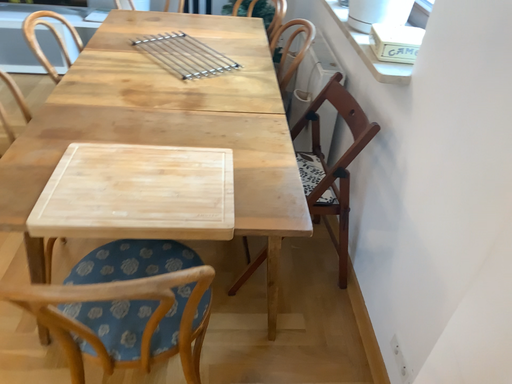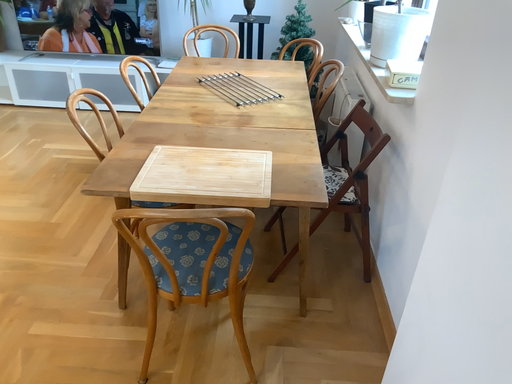
Question: How did the camera likely rotate when shooting the video?

Choices:
 (A) rotated upward
 (B) rotated downward

Answer: (A)